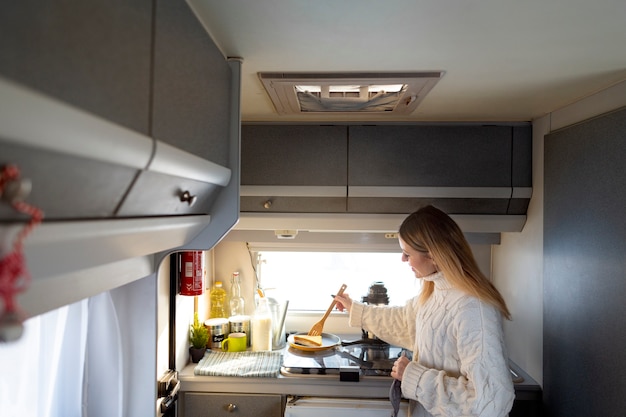
Identify the location of cupboards. (439, 172), (277, 167), (176, 130), (104, 118).